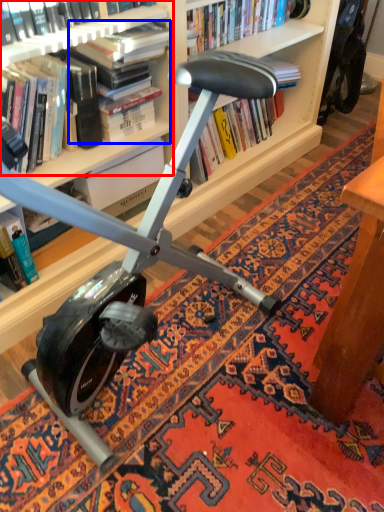
Question: Which object appears farthest to the camera in this image, book (highlighted by a red box) or book (highlighted by a blue box)?

Choices:
 (A) book
 (B) book

Answer: (B)